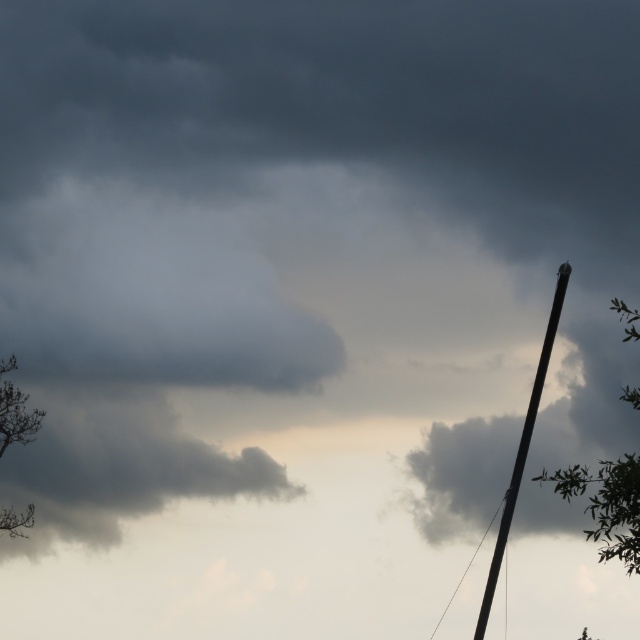
You are standing in the middle of an open field looking at the sky scene described. There are two points marked on the right side of the image. The first point is at coordinates point (x=609, y=490) and the second is at point (x=496, y=545). Which point is closer to you?

Point (x=609, y=490) is in front of point (x=496, y=545), so the first point is closer to you.

You are an astronomer analyzing the sky image. You notice the dark gray cloud at center. Based on its position, can you determine if it is closer to the top or bottom of the image?

The dark gray cloud at center is located at point (120, 467). Since the y coordinate is 0.189, which is closer to the bottom of the image, the dark gray cloud at center is closer to the bottom.